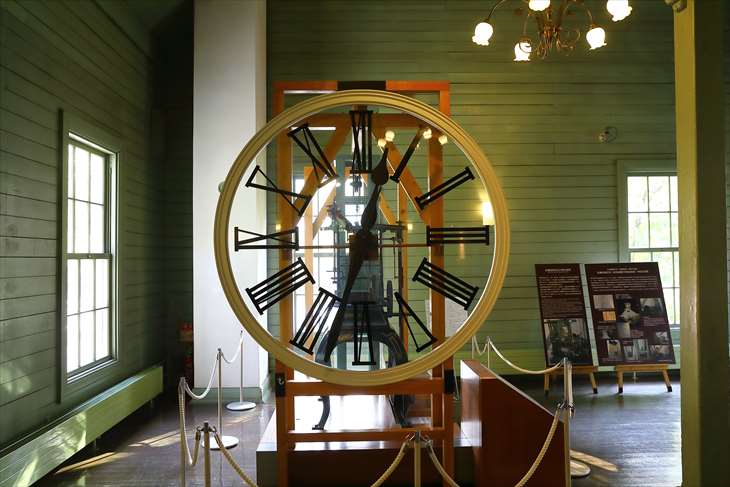
Where is `floor`? floor is located at coordinates (655, 433).